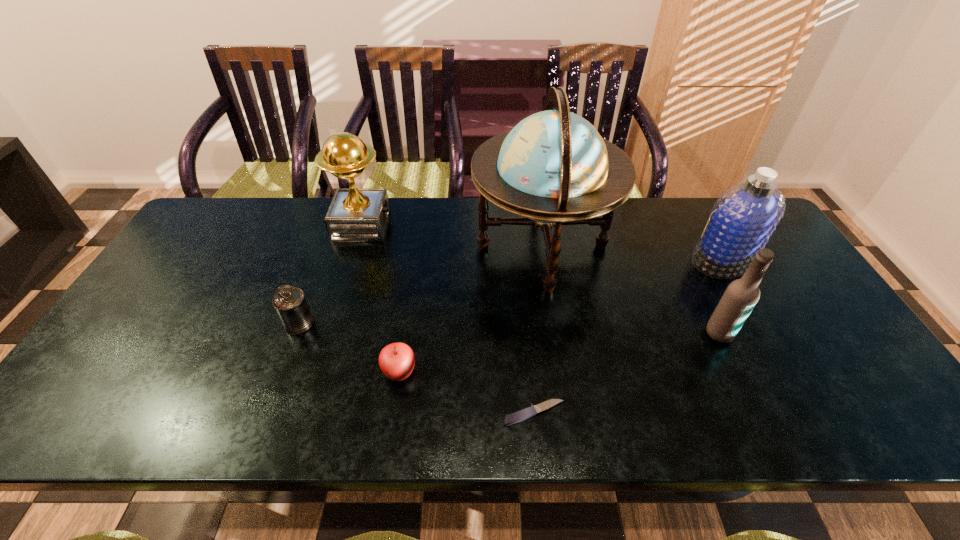
Where is `vacant space located 0.210m on the surface of the globe`? This screenshot has width=960, height=540. vacant space located 0.210m on the surface of the globe is located at coordinates (403, 247).

Where is `free space located 0.370m on the surface of the globe`? Image resolution: width=960 pixels, height=540 pixels. free space located 0.370m on the surface of the globe is located at coordinates (351, 247).

Find the location of a particular element. vacant area situated 0.280m on the front-facing side of the award is located at coordinates (475, 225).

I want to click on free space located 0.060m on the back of the cleansing agent, so click(x=705, y=231).

This screenshot has height=540, width=960. I want to click on free region located 0.190m on the label of the beer bottle, so click(759, 415).

Identify the location of vacant space located on the left of the can. (196, 324).

At what (x,y) coordinates should I click in order to perform the action: click on blank area located 0.320m on the right of the apple. Please return your answer as a coordinate pair (x, y). The width and height of the screenshot is (960, 540). Looking at the image, I should click on (553, 372).

Image resolution: width=960 pixels, height=540 pixels. I want to click on vacant space located on the left of the shortest object, so click(x=398, y=413).

I want to click on globe located in the far edge section of the desktop, so click(553, 168).

This screenshot has width=960, height=540. In order to click on award situated at the far edge in this screenshot , I will do `click(355, 214)`.